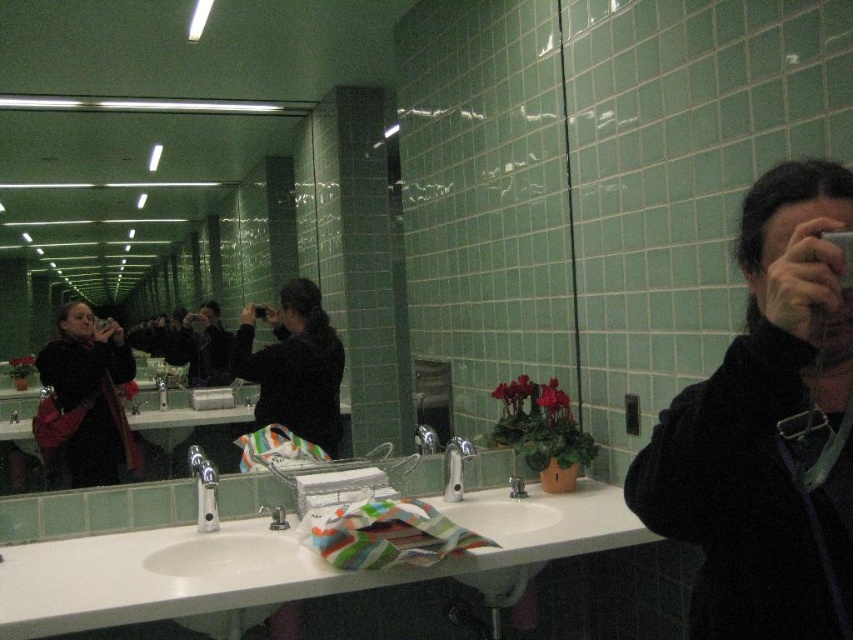
You are standing in the restroom and want to reach a specific point to place a small decorative item. The point is located at coordinates point (206, 552). If you are currently 2 meters away from that point, can you safely step forward to place the item without overstepping?

The distance of point (206, 552) from viewer is 2.11 meters. Since you are currently 2 meters away, you are already closer than the required distance. Stepping forward might cause you to overstep the point. You should move backward slightly to reach the exact location.

You are standing in the public restroom and want to hang a small hook on the wall. The hook requires at least 1 meter of vertical space. Looking at the green tile mirror at center and the black fabric at right, which wall area would you choose to ensure the hook has enough space?

The green tile mirror at center is taller than the black fabric at right, so the area above the green tile mirror at center would provide sufficient vertical space for the hook.